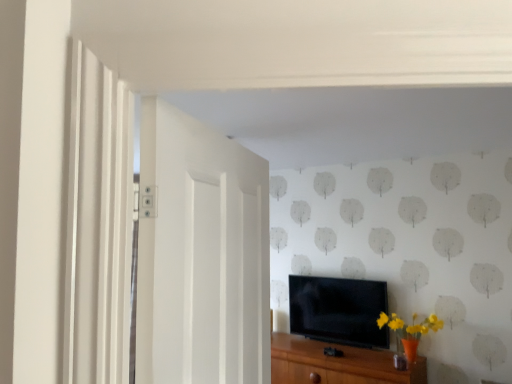
Question: Is white painted wood door at left aimed at brown wood cabinet at lower center?

Choices:
 (A) no
 (B) yes

Answer: (A)

Question: Could brown wood cabinet at lower center be considered to be inside white painted wood door at left?

Choices:
 (A) no
 (B) yes

Answer: (A)

Question: From the image's perspective, is white painted wood door at left under brown wood cabinet at lower center?

Choices:
 (A) yes
 (B) no

Answer: (B)

Question: Is white painted wood door at left further to the viewer compared to brown wood cabinet at lower center?

Choices:
 (A) yes
 (B) no

Answer: (B)

Question: Is white painted wood door at left wider than brown wood cabinet at lower center?

Choices:
 (A) yes
 (B) no

Answer: (B)

Question: Considering the positions of point (367, 289) and point (275, 365), is point (367, 289) closer or farther from the camera than point (275, 365)?

Choices:
 (A) closer
 (B) farther

Answer: (B)

Question: From a real-world perspective, is black glossy tv at center physically located above or below brown wood cabinet at lower center?

Choices:
 (A) above
 (B) below

Answer: (A)

Question: From the image's perspective, is black glossy tv at center positioned above or below brown wood cabinet at lower center?

Choices:
 (A) below
 (B) above

Answer: (B)

Question: Visually, is black glossy tv at center positioned to the left or to the right of brown wood cabinet at lower center?

Choices:
 (A) left
 (B) right

Answer: (B)

Question: Considering the positions of white painted wood door at left and brown wood cabinet at lower center in the image, is white painted wood door at left taller or shorter than brown wood cabinet at lower center?

Choices:
 (A) short
 (B) tall

Answer: (B)

Question: From the image's perspective, is white painted wood door at left above or below brown wood cabinet at lower center?

Choices:
 (A) above
 (B) below

Answer: (A)

Question: Would you say white painted wood door at left is to the left or to the right of brown wood cabinet at lower center in the picture?

Choices:
 (A) left
 (B) right

Answer: (A)

Question: Considering the positions of point (199, 155) and point (333, 362), is point (199, 155) closer or farther from the camera than point (333, 362)?

Choices:
 (A) farther
 (B) closer

Answer: (B)

Question: Is black glossy tv at center to the left or to the right of white painted wood door at left in the image?

Choices:
 (A) left
 (B) right

Answer: (B)

Question: Is black glossy tv at center spatially inside white painted wood door at left, or outside of it?

Choices:
 (A) outside
 (B) inside

Answer: (A)